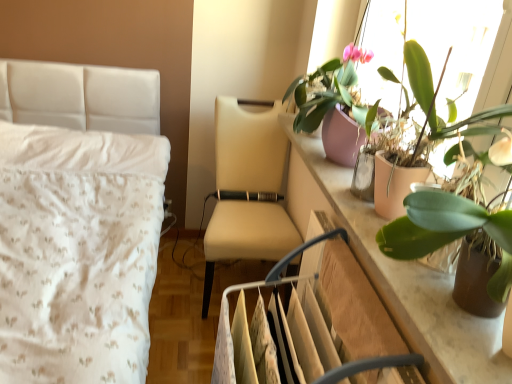
Question: Looking at their shapes, would you say beige fabric chair at center is wider or thinner than green matte leafy plant at upper right, acting as the second houseplant starting from the front?

Choices:
 (A) wide
 (B) thin

Answer: (A)

Question: In the image, is beige fabric chair at center positioned in front of or behind green matte leafy plant at upper right, the second houseplant viewed from the back?

Choices:
 (A) behind
 (B) front

Answer: (A)

Question: Which of these objects is positioned closest to the beige leather swivel chair at center?

Choices:
 (A) beige fabric chair at center
 (B) green matte plant at upper right, arranged as the first houseplant when viewed from the front
 (C) pink matte pot at upper right, the first houseplant in the back-to-front sequence
 (D) green matte leafy plant at upper right, acting as the second houseplant starting from the front

Answer: (D)

Question: Considering the real-world distances, which object is farthest from the green matte plant at upper right, arranged as the first houseplant when viewed from the front?

Choices:
 (A) green matte leafy plant at upper right, the second houseplant viewed from the back
 (B) pink matte pot at upper right, the first houseplant in the back-to-front sequence
 (C) beige leather swivel chair at center
 (D) beige fabric chair at center

Answer: (D)